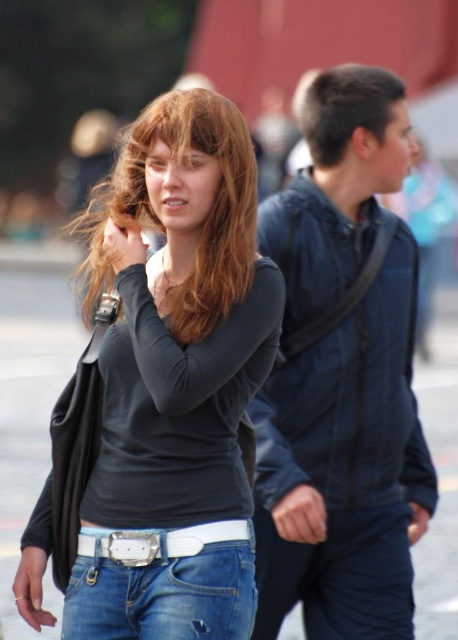
Question: Can you confirm if blonde silky hair at center is bigger than white matte belt at lower center?

Choices:
 (A) yes
 (B) no

Answer: (A)

Question: Can you confirm if denim jeans at lower center is positioned to the left of white matte belt at lower center?

Choices:
 (A) no
 (B) yes

Answer: (B)

Question: Which object appears closest to the camera in this image?

Choices:
 (A) dark blue jacket at center
 (B) denim jeans at lower center
 (C) dark brown hair at upper right

Answer: (B)

Question: Estimate the real-world distances between objects in this image. Which object is farther from the matte black shirt at center?

Choices:
 (A) dark blue jacket at center
 (B) dark brown hair at upper right
 (C) denim jeans at lower center

Answer: (B)

Question: Is denim jeans at lower center in front of dark brown hair at upper right?

Choices:
 (A) yes
 (B) no

Answer: (A)

Question: Considering the real-world distances, which object is closest to the dark brown hair at upper right?

Choices:
 (A) matte black shirt at center
 (B) blonde silky hair at center

Answer: (A)